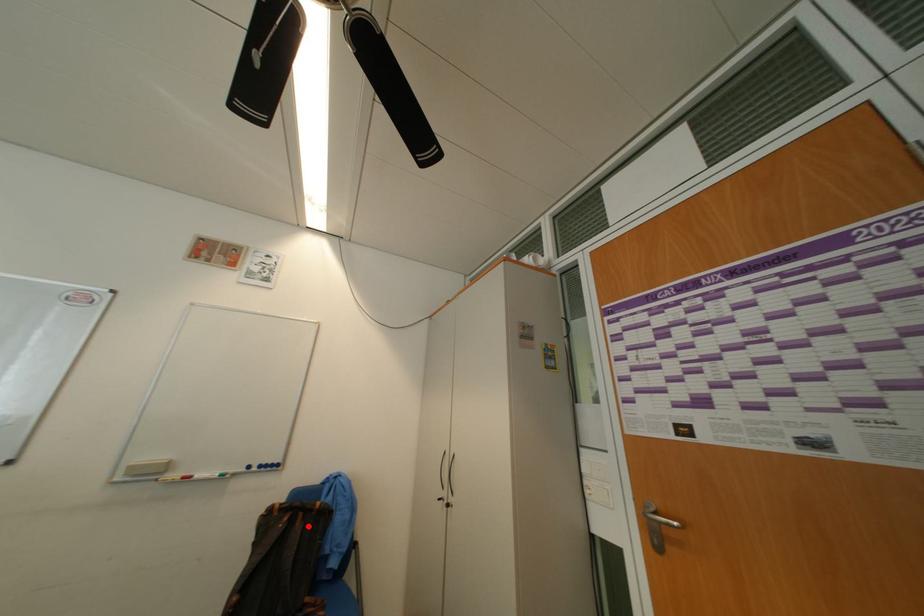
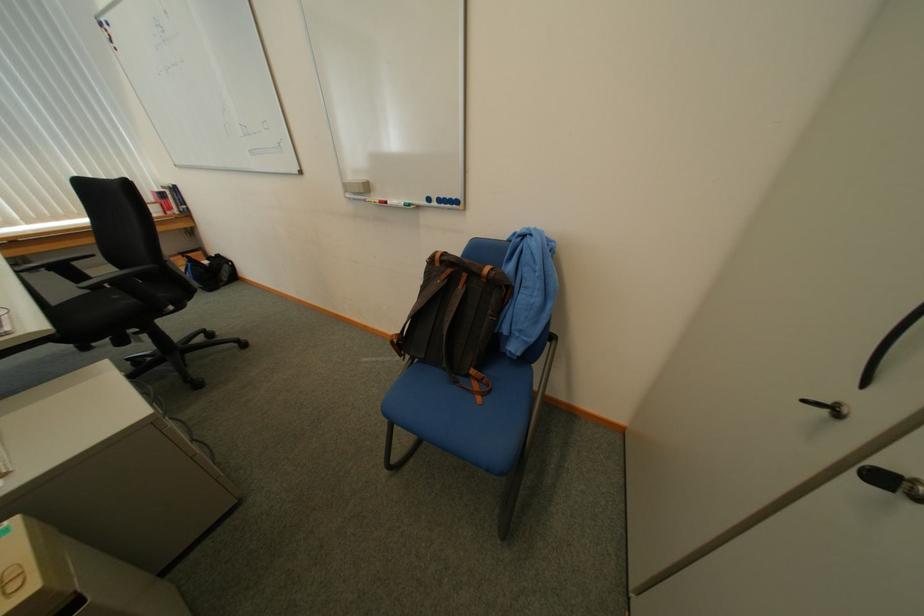
Question: I am providing you with two images of the same scene from different viewpoints. A red point is marked on the first image. Can you still see the location of the red point in image 2?

Choices:
 (A) Yes
 (B) No

Answer: (A)